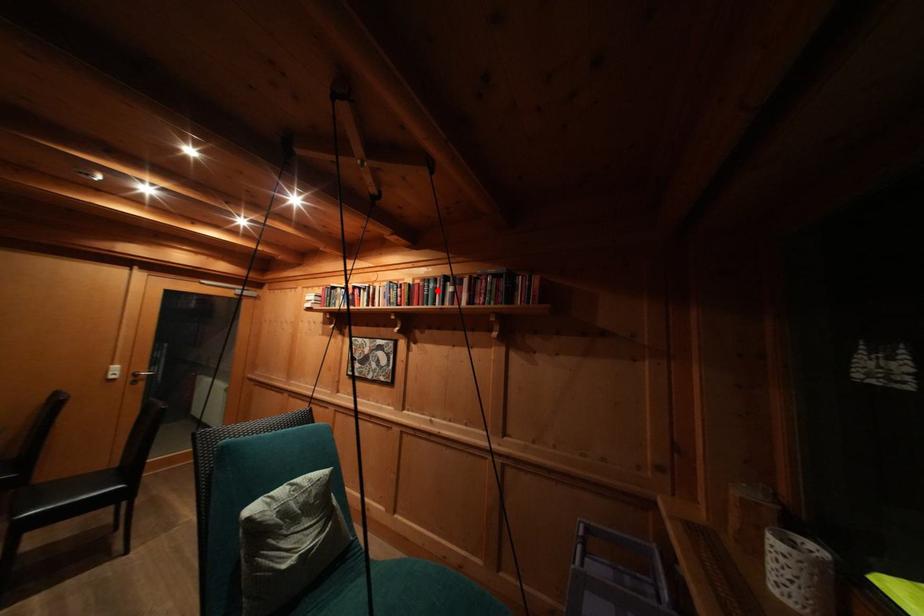
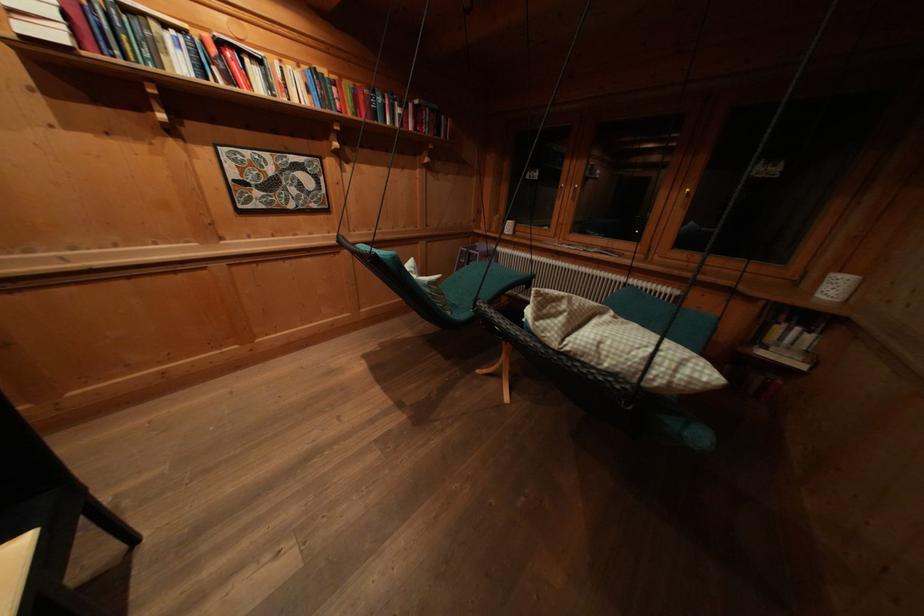
Question: I am providing you with two images of the same scene from different viewpoints. In image1, a red point is highlighted. Considering the same 3D point in image2, which of the following is correct?

Choices:
 (A) It is closer
 (B) It is farther

Answer: (A)